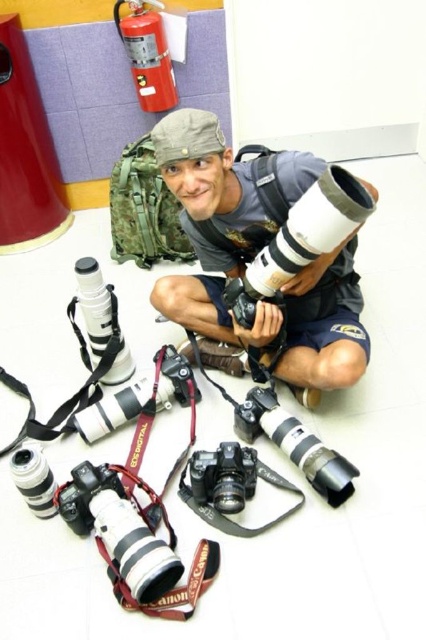
Who is positioned more to the left, matte black camera at center or matte black camera at lower left?

Answer: Positioned to the left is matte black camera at lower left.

Who is more distant from viewer, (250,161) or (134,561)?

The point (250,161) is more distant.

Is point (367, 362) in front of point (143, 596)?

No, it is not.

The width and height of the screenshot is (426, 640). I want to click on matte black camera at center, so click(285, 321).

Which is above, matte black camera at center or black plastic camera at center?

Positioned higher is matte black camera at center.

Does matte black camera at center have a lesser width compared to black plastic camera at center?

Incorrect, matte black camera at center's width is not less than black plastic camera at center's.

Which is behind, point (347, 333) or point (244, 460)?

The point (347, 333) is behind.

Where is `matte black camera at center`? matte black camera at center is located at coordinates (285, 321).

Is point (175, 541) behind point (221, 464)?

No, it is not.

Who is more distant from viewer, (91, 506) or (204, 480)?

The point (204, 480) is more distant.

This screenshot has height=640, width=426. I want to click on matte black camera at lower left, so click(x=120, y=529).